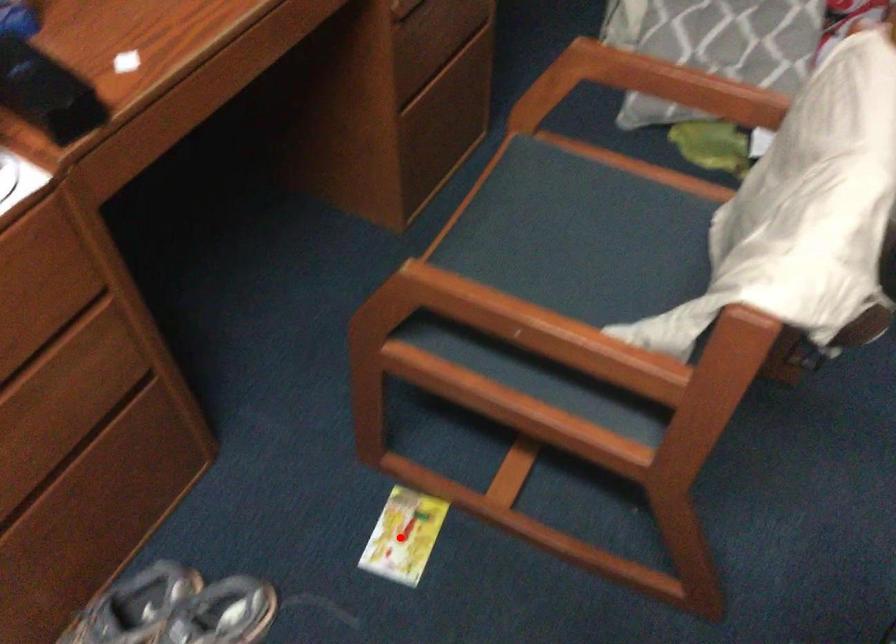
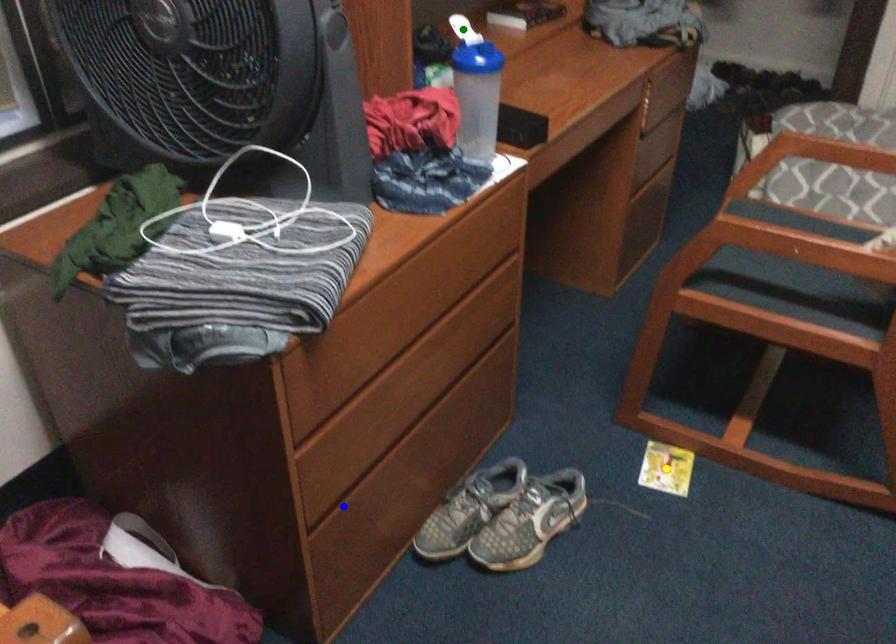
Question: I am providing you with two images of the same scene from different viewpoints. A red point is marked on the first image. You are given multiple points on the second image. In image 2, which mark is for the same physical point as the one in image 1?

Choices:
 (A) yellow point
 (B) blue point
 (C) green point

Answer: (A)